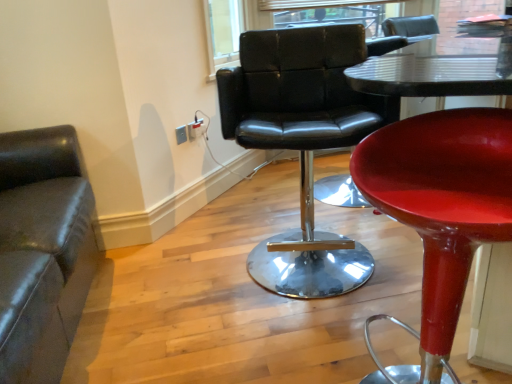
Question: Can you confirm if matte white electrical outlet at upper center, which is the first electric outlet from front to back, is positioned to the left of black leather chair at center, placed as the second chair when sorted from right to left?

Choices:
 (A) yes
 (B) no

Answer: (A)

Question: Is matte white electrical outlet at upper center, the 2th electric outlet viewed from the back, behind black leather chair at center, placed as the second chair when sorted from right to left?

Choices:
 (A) yes
 (B) no

Answer: (A)

Question: From the image's perspective, is matte white electrical outlet at upper center, which is the first electric outlet from front to back, over black leather chair at center, placed as the second chair when sorted from right to left?

Choices:
 (A) yes
 (B) no

Answer: (A)

Question: Is matte white electrical outlet at upper center, the 2th electric outlet viewed from the back, far away from black leather chair at center, the 2th chair viewed from the left?

Choices:
 (A) yes
 (B) no

Answer: (B)

Question: From a real-world perspective, is matte white electrical outlet at upper center, the 2th electric outlet viewed from the back, located beneath black leather chair at center, the 2th chair viewed from the left?

Choices:
 (A) no
 (B) yes

Answer: (B)

Question: Is shiny red stool at center, the 1th chair in the right-to-left sequence, inside or outside of matte black leather chair at left, the 1th chair from the left?

Choices:
 (A) inside
 (B) outside

Answer: (B)

Question: In terms of size, does shiny red stool at center, the 1th chair in the right-to-left sequence, appear bigger or smaller than matte black leather chair at left, the 1th chair from the left?

Choices:
 (A) big
 (B) small

Answer: (B)

Question: Based on their positions, is shiny red stool at center, the 1th chair in the right-to-left sequence, located to the left or right of matte black leather chair at left, the 1th chair from the left?

Choices:
 (A) right
 (B) left

Answer: (A)

Question: Is shiny red stool at center, the 1th chair in the right-to-left sequence, wider or thinner than matte black leather chair at left, which is the 3th chair from right to left?

Choices:
 (A) wide
 (B) thin

Answer: (B)

Question: Is point (423, 185) closer or farther from the camera than point (186, 125)?

Choices:
 (A) closer
 (B) farther

Answer: (A)

Question: Is shiny red stool at center, the third chair when ordered from left to right, in front of or behind white plastic electrical outlet at upper center, the 2th electric outlet from the front, in the image?

Choices:
 (A) front
 (B) behind

Answer: (A)

Question: In terms of height, does shiny red stool at center, the 1th chair in the right-to-left sequence, look taller or shorter compared to white plastic electrical outlet at upper center, the 2th electric outlet from the front?

Choices:
 (A) tall
 (B) short

Answer: (A)

Question: Visually, is shiny red stool at center, the third chair when ordered from left to right, positioned to the left or to the right of white plastic electrical outlet at upper center, the 2th electric outlet from the front?

Choices:
 (A) right
 (B) left

Answer: (A)

Question: Considering their positions, is matte black leather chair at left, the 1th chair from the left, located in front of or behind shiny red stool at center, the third chair when ordered from left to right?

Choices:
 (A) behind
 (B) front

Answer: (B)

Question: In terms of size, does matte black leather chair at left, the 1th chair from the left, appear bigger or smaller than shiny red stool at center, the third chair when ordered from left to right?

Choices:
 (A) big
 (B) small

Answer: (A)